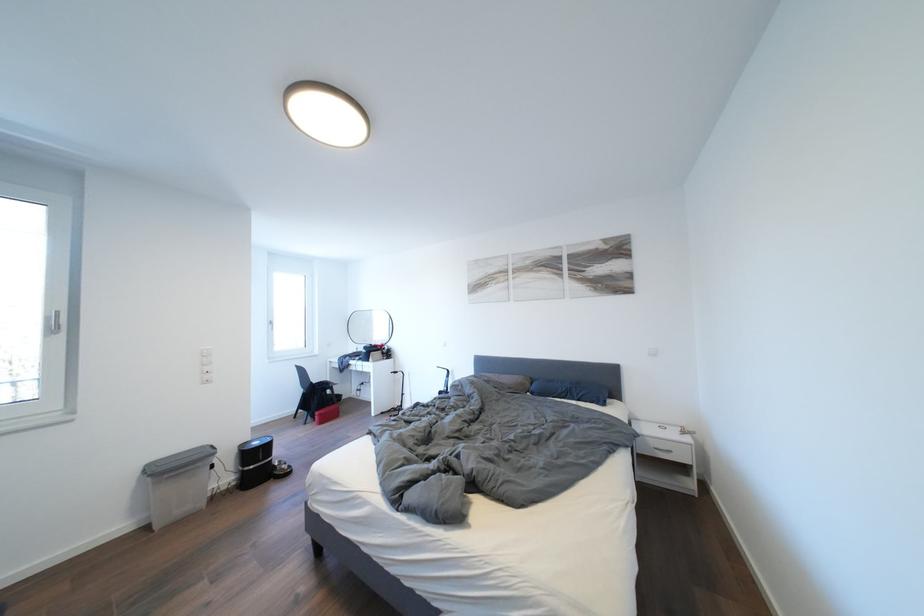
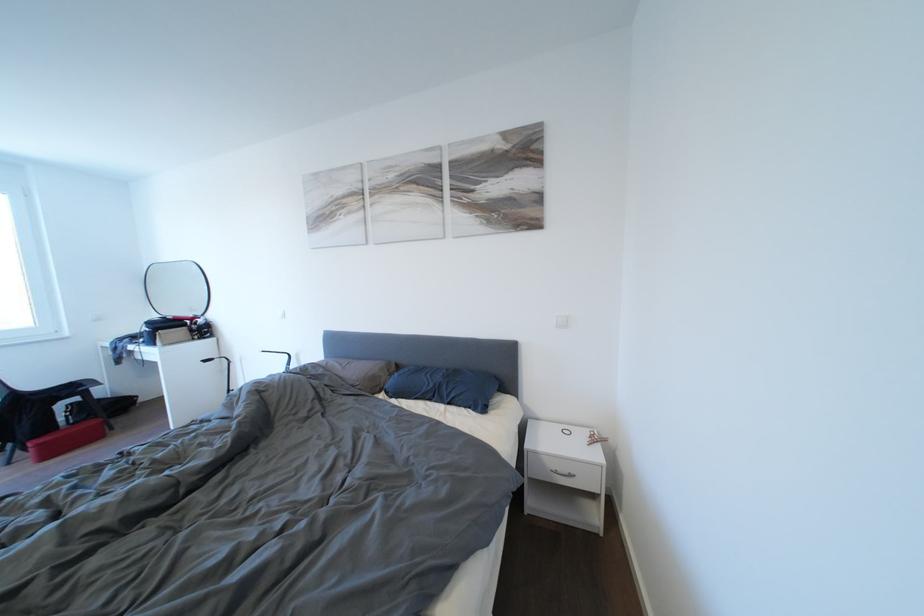
The point at (329, 419) is marked in the first image. Where is the corresponding point in the second image?

(46, 450)